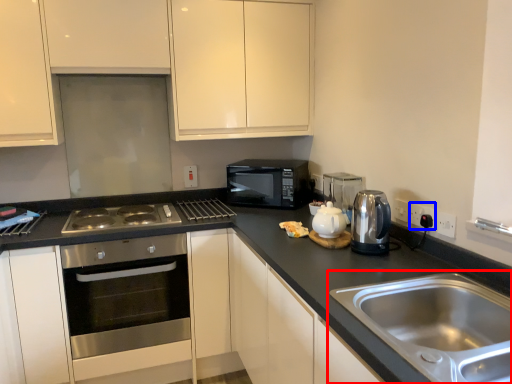
Question: Among these objects, which one is farthest to the camera, sink (highlighted by a red box) or electric outlet (highlighted by a blue box)?

Choices:
 (A) sink
 (B) electric outlet

Answer: (B)